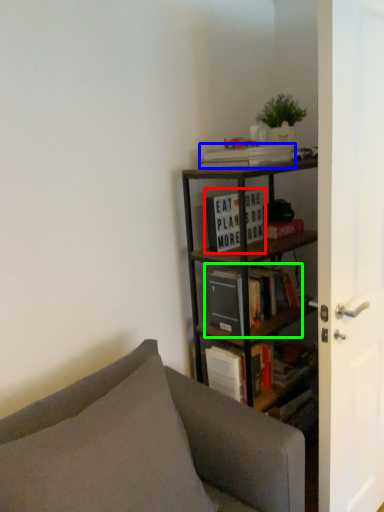
Question: Which is nearer to the book (highlighted by a red box)? book (highlighted by a blue box) or book (highlighted by a green box).

Choices:
 (A) book
 (B) book

Answer: (A)